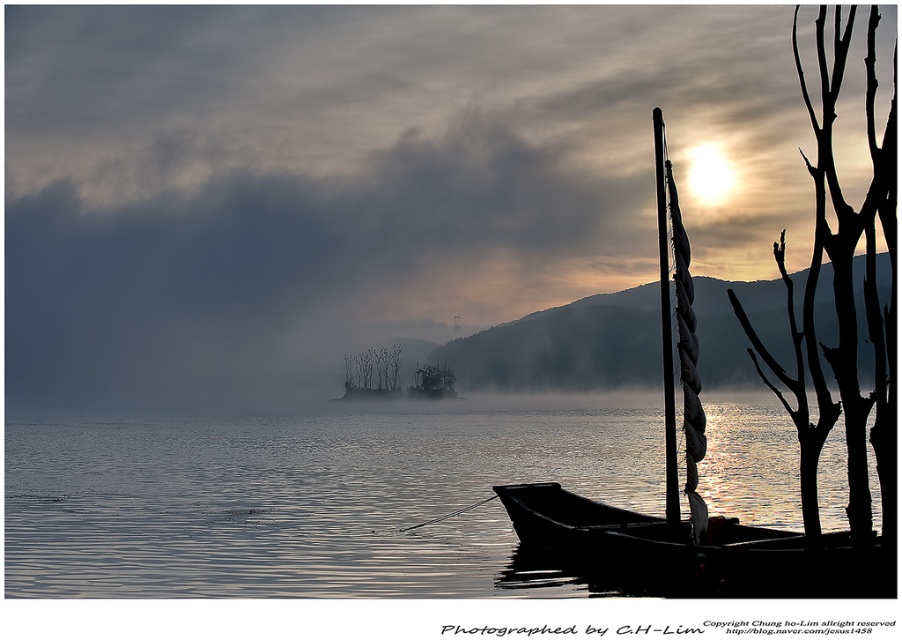
Is transparent water at center to the right of black wood canoe at lower right from the viewer's perspective?

Incorrect, transparent water at center is not on the right side of black wood canoe at lower right.

Between point (825, 486) and point (689, 550), which one is positioned behind?

Point (825, 486)

You are a GUI agent. You are given a task and a screenshot of the screen. Output one action in this format:
    pyautogui.click(x=<x>, y=<y>)
    Task: Click on the transparent water at center
    
    Given the screenshot: What is the action you would take?
    pyautogui.click(x=307, y=499)

Does foggy mist at center appear on the left side of transparent water at center?

In fact, foggy mist at center is to the right of transparent water at center.

Consider the image. Can you confirm if foggy mist at center is bigger than transparent water at center?

Correct, foggy mist at center is larger in size than transparent water at center.

What do you see at coordinates (362, 179) in the screenshot? This screenshot has width=902, height=640. I see `foggy mist at center` at bounding box center [362, 179].

You are a GUI agent. You are given a task and a screenshot of the screen. Output one action in this format:
    pyautogui.click(x=<x>, y=<y>)
    Task: Click on the foggy mist at center
    
    Given the screenshot: What is the action you would take?
    pyautogui.click(x=362, y=179)

Between foggy mist at center and black wood canoe at lower right, which one has less height?

With less height is black wood canoe at lower right.

Does foggy mist at center come in front of black wood canoe at lower right?

Yes, foggy mist at center is closer to the viewer.

What do you see at coordinates (362, 179) in the screenshot? This screenshot has width=902, height=640. I see `foggy mist at center` at bounding box center [362, 179].

Find the location of a particular element. This screenshot has width=902, height=640. foggy mist at center is located at coordinates (362, 179).